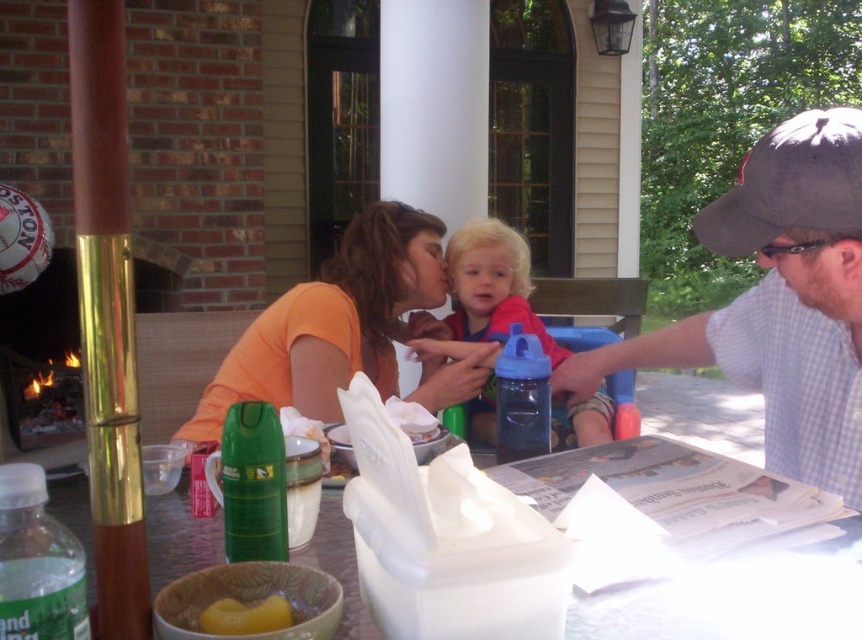
Between orange matte shirt at center and translucent plastic table at center, which one is positioned higher?

orange matte shirt at center

This screenshot has width=862, height=640. What are the coordinates of `orange matte shirt at center` in the screenshot? It's located at [335, 323].

Image resolution: width=862 pixels, height=640 pixels. In order to click on orange matte shirt at center in this screenshot , I will do `click(335, 323)`.

Does green plastic spray bottle at center come behind blue plastic sippy cup at center?

That is False.

Where is `green plastic spray bottle at center`? Image resolution: width=862 pixels, height=640 pixels. green plastic spray bottle at center is located at coordinates (253, 483).

Which is behind, point (230, 499) or point (542, 356)?

The point (542, 356) is behind.

I want to click on green plastic spray bottle at center, so click(253, 483).

Does point (483, 269) come farther from viewer compared to point (251, 465)?

Yes, it is behind point (251, 465).

In the scene shown: Is red fabric shirt at center wider than green plastic spray bottle at center?

Correct, the width of red fabric shirt at center exceeds that of green plastic spray bottle at center.

What do you see at coordinates (486, 292) in the screenshot? This screenshot has width=862, height=640. I see `red fabric shirt at center` at bounding box center [486, 292].

Image resolution: width=862 pixels, height=640 pixels. In order to click on red fabric shirt at center in this screenshot , I will do `click(486, 292)`.